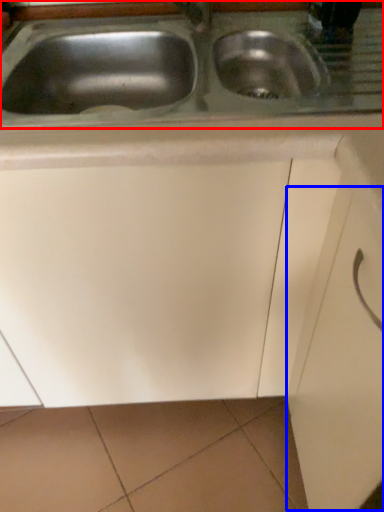
Question: Which of the following is the closest to the observer, sink (highlighted by a red box) or drawer (highlighted by a blue box)?

Choices:
 (A) sink
 (B) drawer

Answer: (B)